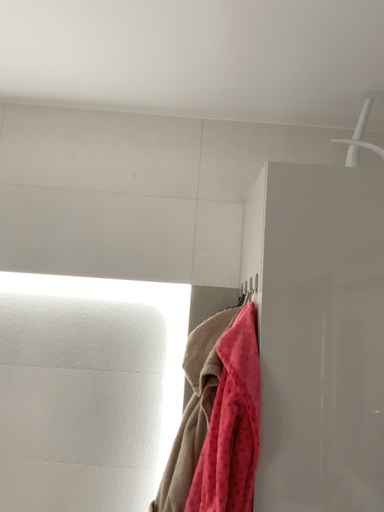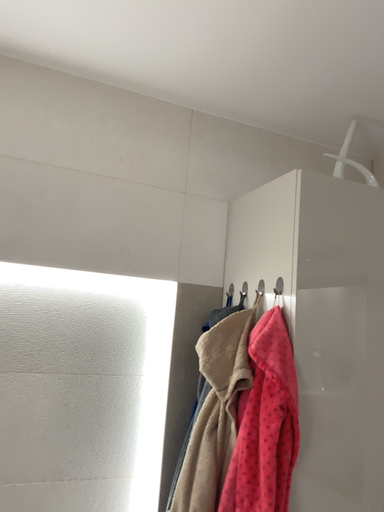
Question: How did the camera likely rotate when shooting the video?

Choices:
 (A) rotated right
 (B) rotated left

Answer: (A)